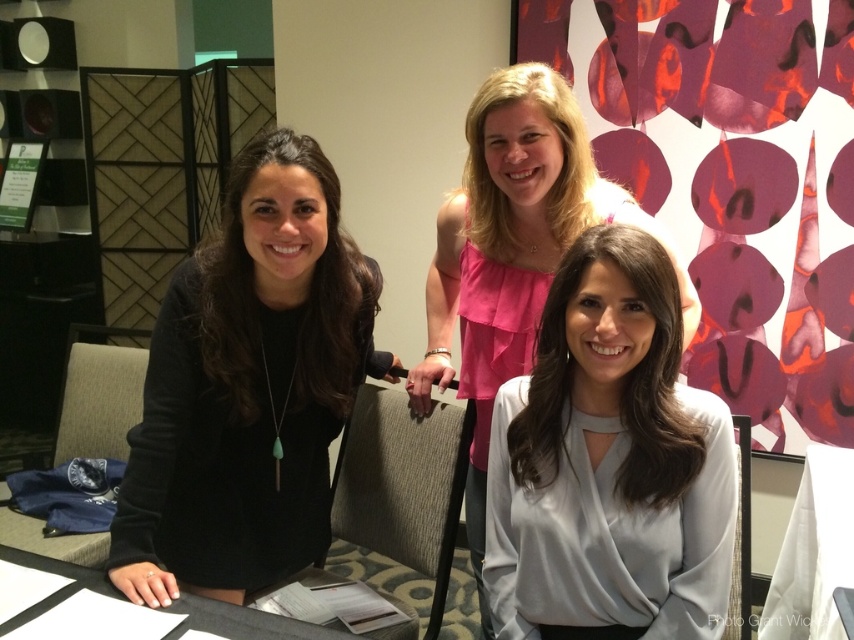
Question: Which point is closer to the camera?

Choices:
 (A) pink satin blouse at center
 (B) black matte dress at left

Answer: (A)

Question: Does satin white blouse at center appear on the left side of pink satin blouse at center?

Choices:
 (A) no
 (B) yes

Answer: (A)

Question: Is pink satin blouse at center positioned at the back of white paper at lower center?

Choices:
 (A) yes
 (B) no

Answer: (A)

Question: Which object is the farthest from the pink satin blouse at center?

Choices:
 (A) white paper at lower center
 (B) black matte dress at left

Answer: (A)

Question: Is satin white blouse at center positioned in front of white paper at lower center?

Choices:
 (A) yes
 (B) no

Answer: (A)

Question: Which is nearer to the white paper at lower center?

Choices:
 (A) satin white blouse at center
 (B) pink satin blouse at center
 (C) black matte dress at left

Answer: (C)